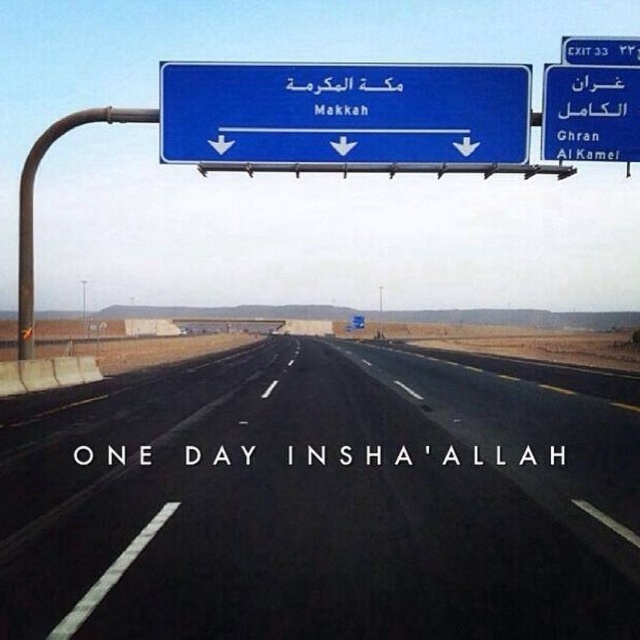
You are a GPS system trying to locate the black asphalt highway at center on a map. What coordinates should you use to mark its position?

The coordinates to mark the position of the black asphalt highway at center are at point (317, 502).

You are a driver approaching the blue metallic sign at center and the blue plastic exit sign at upper right. Which one is positioned lower in the image?

The blue metallic sign at center is positioned below the blue plastic exit sign at upper right, so it is lower in the image.

You are a truck driver planning to take the exit at Ghran. You see the black asphalt highway at center and the blue plastic exit sign at upper right. Which object is larger in the image?

The blue plastic exit sign at upper right is larger than the black asphalt highway at center in the image.